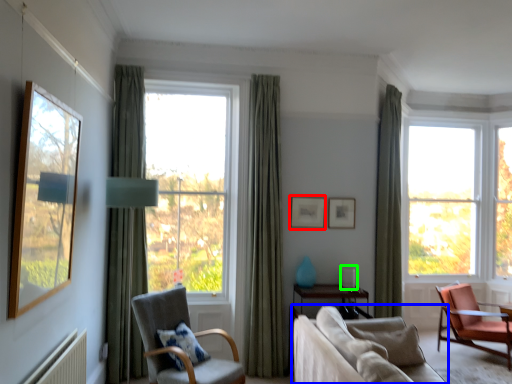
Question: Based on their relative distances, which object is nearer to picture frame (highlighted by a red box)? Choose from studio couch (highlighted by a blue box) and table lamp (highlighted by a green box).

Choices:
 (A) studio couch
 (B) table lamp

Answer: (B)